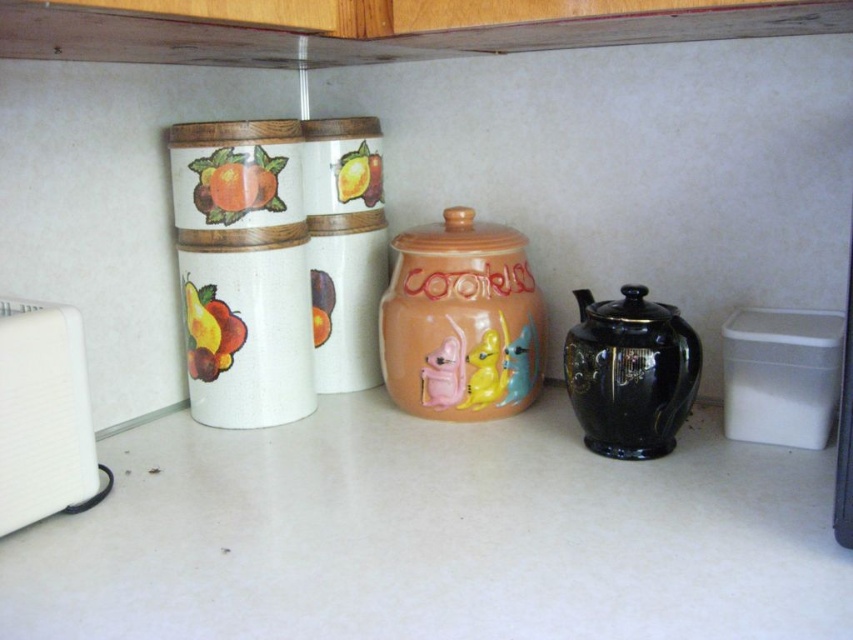
In the scene shown: You are organizing items on the white matte counter top at center. Where exactly is this counter top located in the image?

The white matte counter top at center is located at point coordinates of 0.838 on the x axis and 0.510 on the y axis.

You are standing in front of the kitchen countertop and want to place a 12 inch wide vase on the white matte counter top at center. Can the vase fit on the counter top without overhanging the edges?

The white matte counter top at center and camera are 25.73 inches apart, but this measurement does not indicate the counter top width. Therefore, it is unclear if the 12 inch vase will fit without overhanging the edges.

You are organizing items on the kitchen countertop and need to place a new spice jar. The white plastic toaster at left is currently blocking access to the white matte counter top at center. Can you move the spice jar to the center area without moving the toaster?

The white matte counter top at center is in front of the white plastic toaster at left, meaning the counter top is closer to you than the toaster. Since the counter top is already in front, you can place the spice jar directly on the center area without needing to move the toaster.